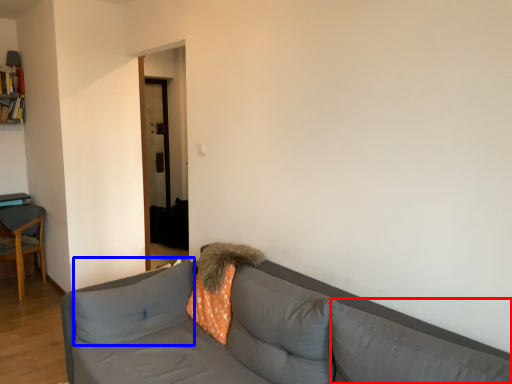
Question: Which object appears farthest to the camera in this image, pillow (highlighted by a red box) or pillow (highlighted by a blue box)?

Choices:
 (A) pillow
 (B) pillow

Answer: (B)